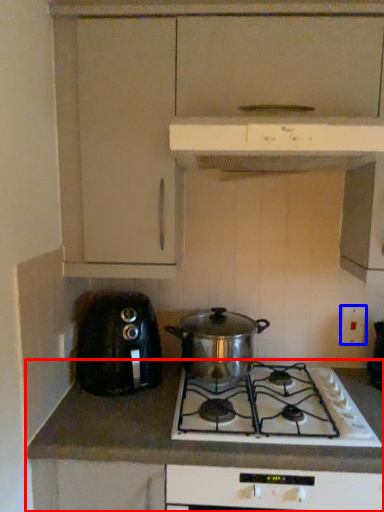
Question: Which object is closer to the camera taking this photo, countertop (highlighted by a red box) or electric outlet (highlighted by a blue box)?

Choices:
 (A) countertop
 (B) electric outlet

Answer: (A)